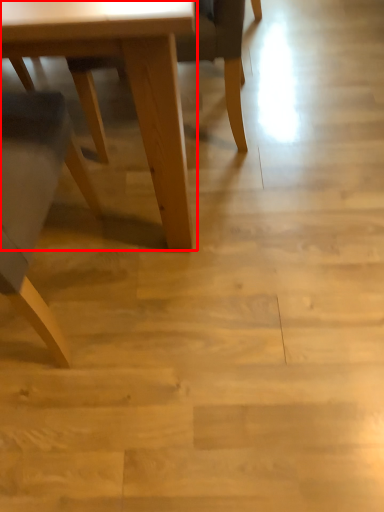
Question: From the image, what is the correct spatial relationship of table (annotated by the red box) in relation to chair?

Choices:
 (A) left
 (B) right

Answer: (A)